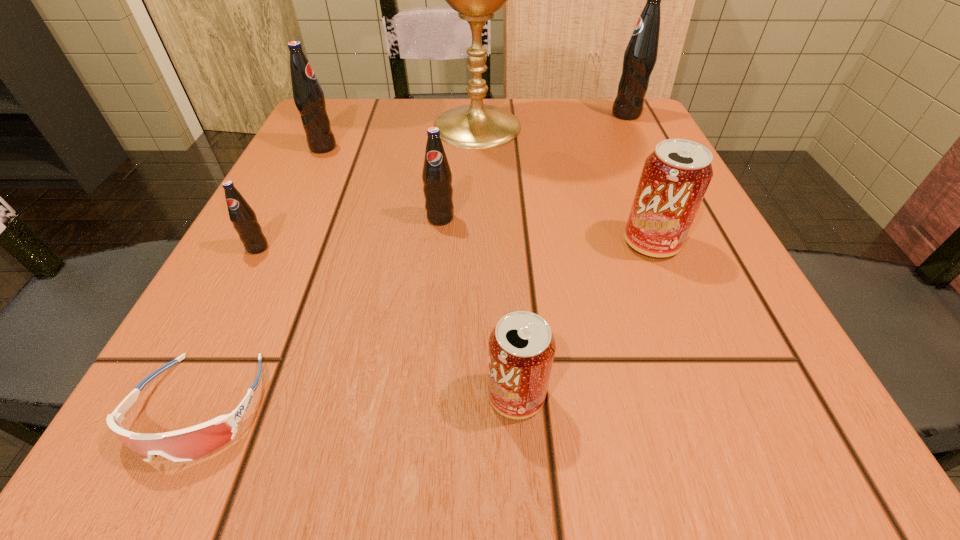
Identify the location of the nearer red soda can. The height and width of the screenshot is (540, 960). (521, 347).

The image size is (960, 540). Identify the location of the nearest soda can. (521, 347).

Find the location of a particular element. The image size is (960, 540). goggles is located at coordinates (191, 443).

Find the location of a particular element. The image size is (960, 540). the shortest object is located at coordinates (191, 443).

I want to click on free spot located on the front of the trophy cup, so click(476, 189).

The height and width of the screenshot is (540, 960). I want to click on free location located 0.060m on the front label of the rightmost black pop, so click(x=585, y=114).

Locate an element on the screen. The height and width of the screenshot is (540, 960). vacant space located 0.280m on the front label of the rightmost black pop is located at coordinates (485, 114).

Where is `free space located 0.090m on the front label of the rightmost black pop`? The width and height of the screenshot is (960, 540). free space located 0.090m on the front label of the rightmost black pop is located at coordinates (571, 114).

This screenshot has height=540, width=960. What are the coordinates of `free space located on the front label of the fifth shortest soda can` in the screenshot? It's located at (497, 147).

Find the location of a particular element. vacant area situated on the front label of the second black pop from right to left is located at coordinates (416, 469).